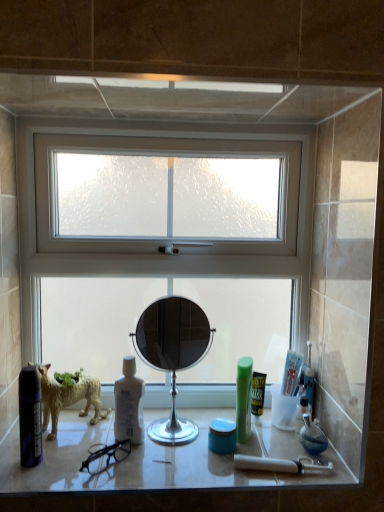
Identify the location of vacant space in between matte black can at left and white glossy mouthwash at center, the 1th mouthwash viewed from the left. This screenshot has height=512, width=384. (87, 453).